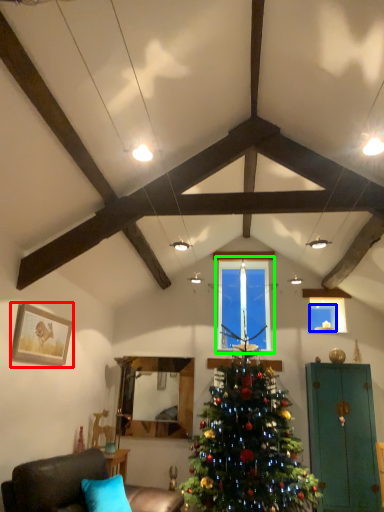
Question: Which is nearer to the picture frame (highlighted by a red box)? window screen (highlighted by a blue box) or window (highlighted by a green box).

Choices:
 (A) window screen
 (B) window

Answer: (B)